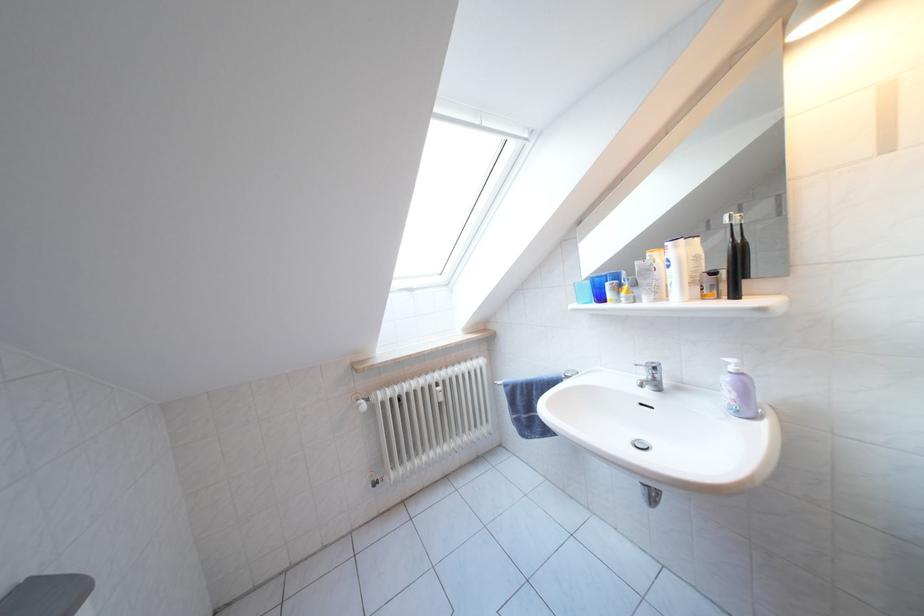
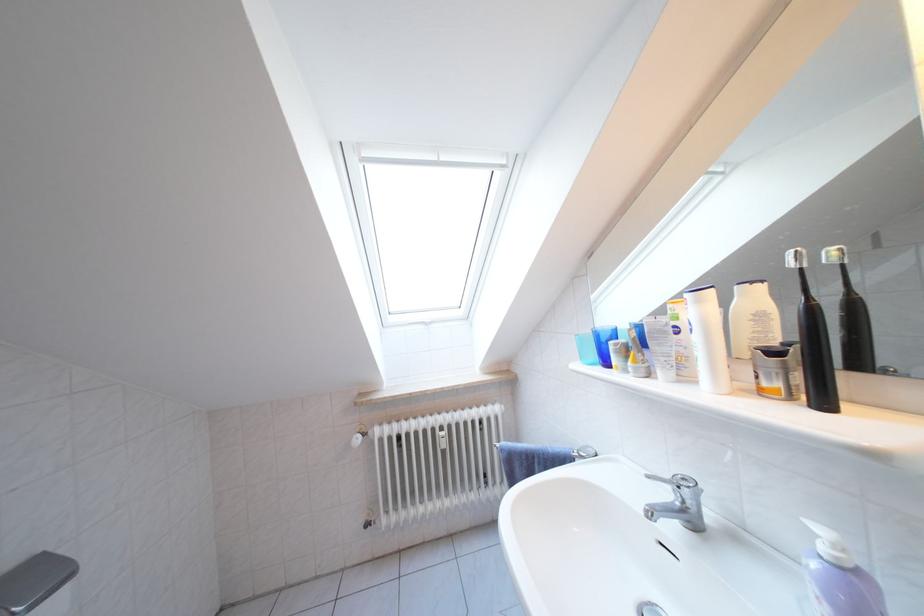
Where in the second image is the point corresponding to point (745, 300) from the first image?

(833, 407)